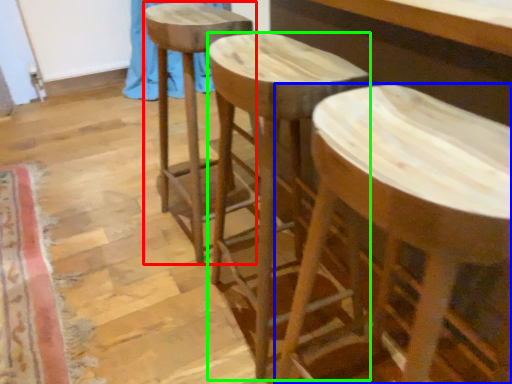
Question: Which object is the closest to the stool (highlighted by a red box)? Choose among these: stool (highlighted by a blue box) or stool (highlighted by a green box).

Choices:
 (A) stool
 (B) stool

Answer: (B)